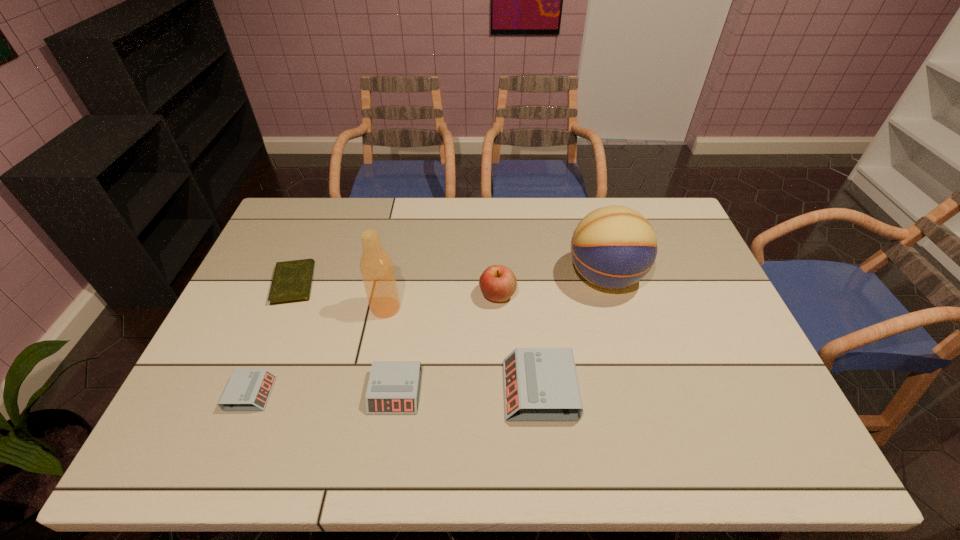
Observe the arrangement of all alarm clocks in the image. To keep them evenly spaced, where would you place another alarm clock on the right? Please locate a free space. Please provide its 2D coordinates. Your answer should be formatted as a tuple, i.e. [(x, y)], where the tuple contains the x and y coordinates of a point satisfying the conditions above.

[(682, 388)]